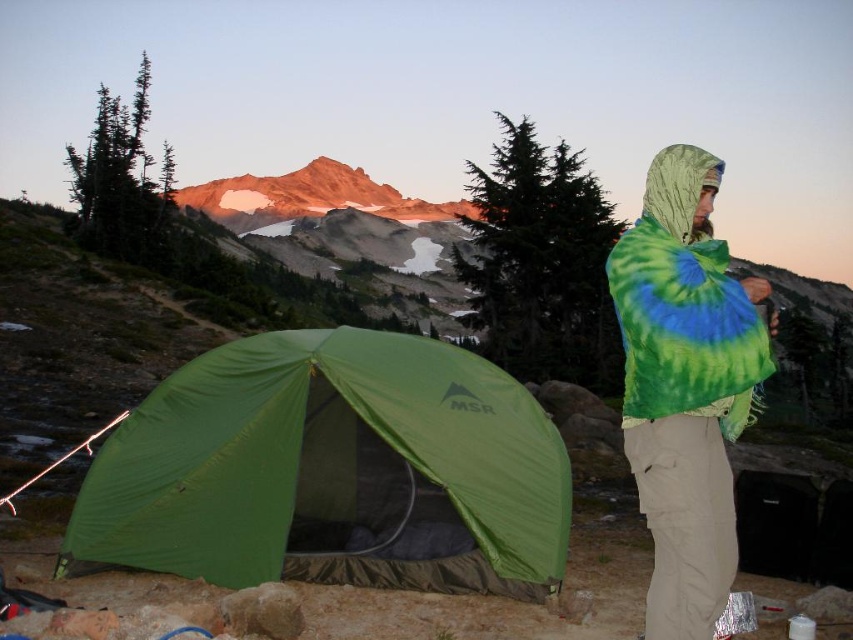
Consider the image. Can you confirm if tie-dye fabric at right is positioned to the left of green matte pine at center?

Incorrect, tie-dye fabric at right is not on the left side of green matte pine at center.

Does point (715, 554) come closer to viewer compared to point (479, 205)?

Yes, point (715, 554) is in front of point (479, 205).

Between point (646, 336) and point (556, 156), which one is positioned in front?

Point (646, 336) is in front.

This screenshot has width=853, height=640. In order to click on tie-dye fabric at right in this screenshot , I will do `click(685, 385)`.

Can you confirm if green fabric tent at lower left is positioned to the left of tie-dye fabric at right?

Indeed, green fabric tent at lower left is positioned on the left side of tie-dye fabric at right.

Between green fabric tent at lower left and tie-dye fabric at right, which one appears on the left side from the viewer's perspective?

green fabric tent at lower left

Is point (306, 435) in front of point (677, 451)?

That is False.

Locate an element on the screen. The image size is (853, 640). green fabric tent at lower left is located at coordinates (332, 470).

Does point (450, 428) come farther from viewer compared to point (369, 186)?

No, it is not.

Does green fabric tent at lower left have a greater height compared to rustic granite peak at upper center?

No.

Locate an element on the screen. The height and width of the screenshot is (640, 853). green fabric tent at lower left is located at coordinates (332, 470).